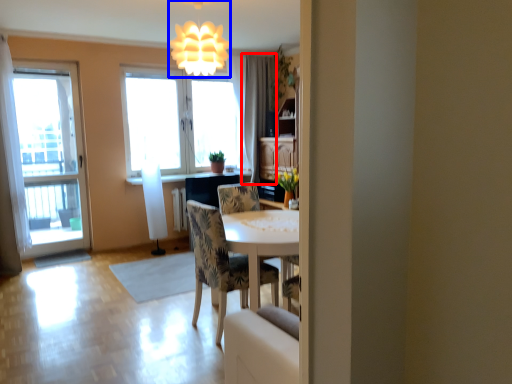
Question: Which object appears closest to the camera in this image, curtain (highlighted by a red box) or fixture (highlighted by a blue box)?

Choices:
 (A) curtain
 (B) fixture

Answer: (B)